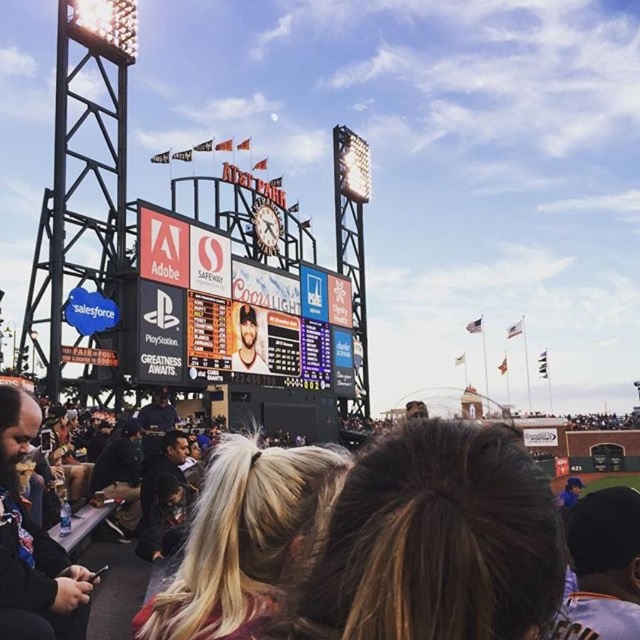
Between black glossy scoreboard at center and matte baseball cap at center, which one appears on the left side from the viewer's perspective?

matte baseball cap at center is more to the left.

Looking at this image, who is higher up, black glossy scoreboard at center or matte baseball cap at center?

Positioned higher is black glossy scoreboard at center.

This screenshot has height=640, width=640. Describe the element at coordinates (241, 310) in the screenshot. I see `black glossy scoreboard at center` at that location.

Locate an element on the screen. black glossy scoreboard at center is located at coordinates (241, 310).

Between brown hair at lower center and dark brown leather jacket at lower left, which one is positioned higher?

Positioned higher is brown hair at lower center.

Does point (22, 449) lie in front of point (6, 433)?

No, it is not.

Is point (236, 552) in front of point (4, 422)?

Yes, it is in front of point (4, 422).

Locate an element on the screen. brown hair at lower center is located at coordinates (276, 500).

Is black glossy scoreboard at center thinner than dark brown leather jacket at lower left?

Incorrect, black glossy scoreboard at center's width is not less than dark brown leather jacket at lower left's.

What do you see at coordinates (241, 310) in the screenshot? This screenshot has height=640, width=640. I see `black glossy scoreboard at center` at bounding box center [241, 310].

Where is `black glossy scoreboard at center`? The image size is (640, 640). black glossy scoreboard at center is located at coordinates (241, 310).